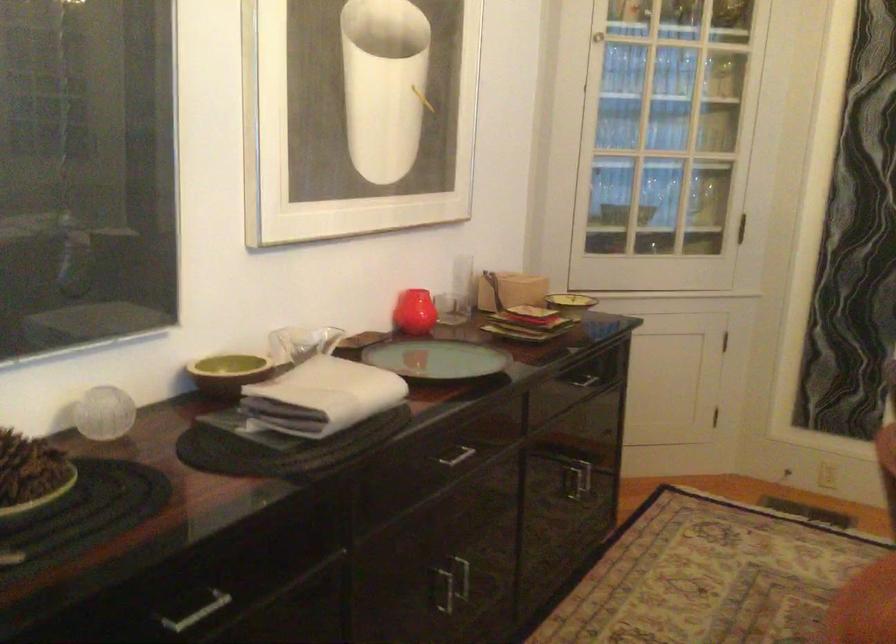
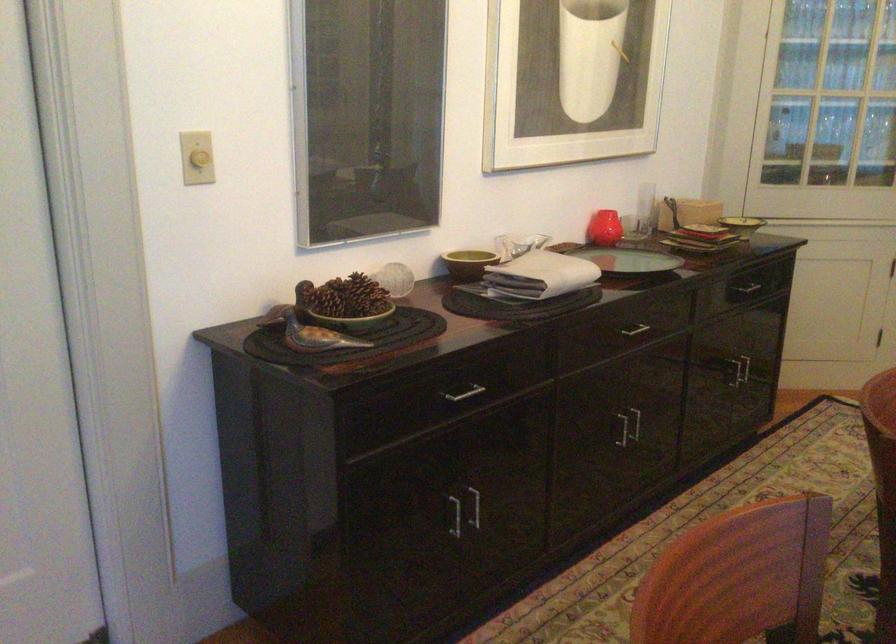
Find the pixel in the second image that matches [452,457] in the first image.

(634, 328)